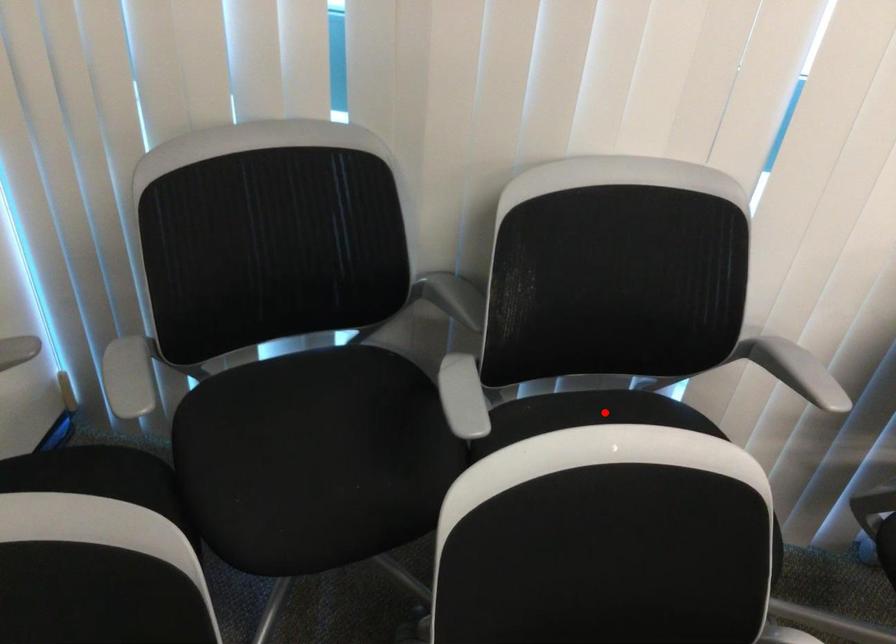
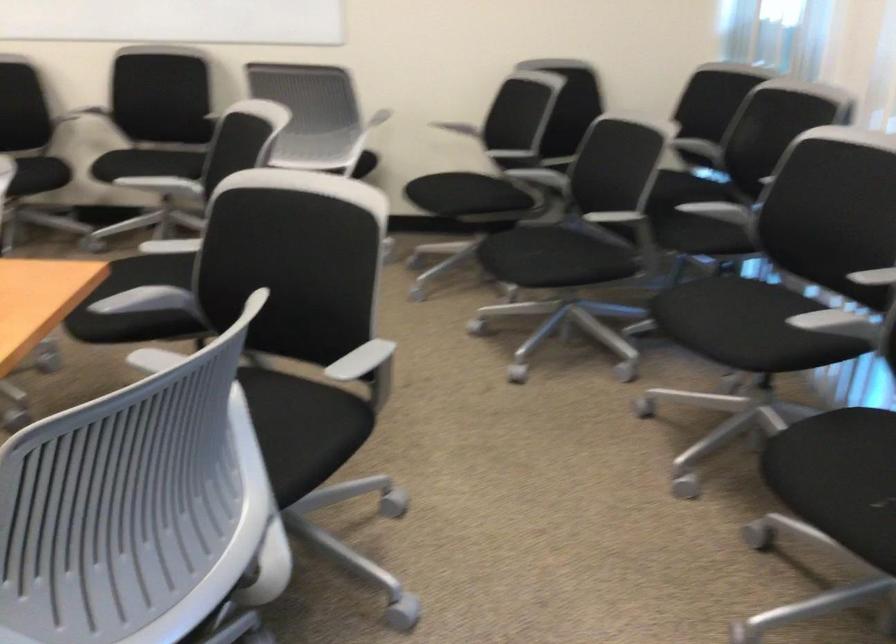
Question: I am providing you with two images of the same scene from different viewpoints. A red point is marked on the first image. Is the red point's position out of view in image 2?

Choices:
 (A) Yes
 (B) No

Answer: (A)